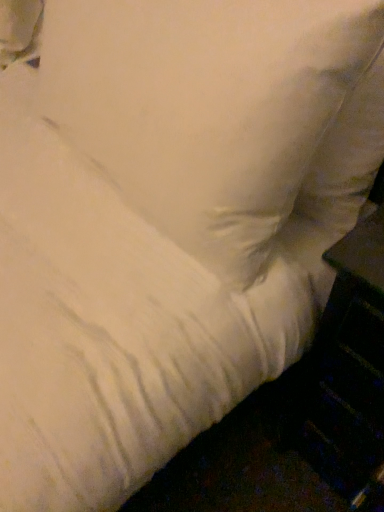
What do you see at coordinates (349, 374) in the screenshot?
I see `black glossy table at lower right` at bounding box center [349, 374].

At what (x,y) coordinates should I click in order to perform the action: click on black glossy table at lower right. Please return your answer as a coordinate pair (x, y). The image size is (384, 512). Looking at the image, I should click on (349, 374).

In order to face black glossy table at lower right, should I rotate leftwards or rightwards?

Rotate your view right by about 26.364°.

Find the location of a particular element. black glossy table at lower right is located at coordinates (349, 374).